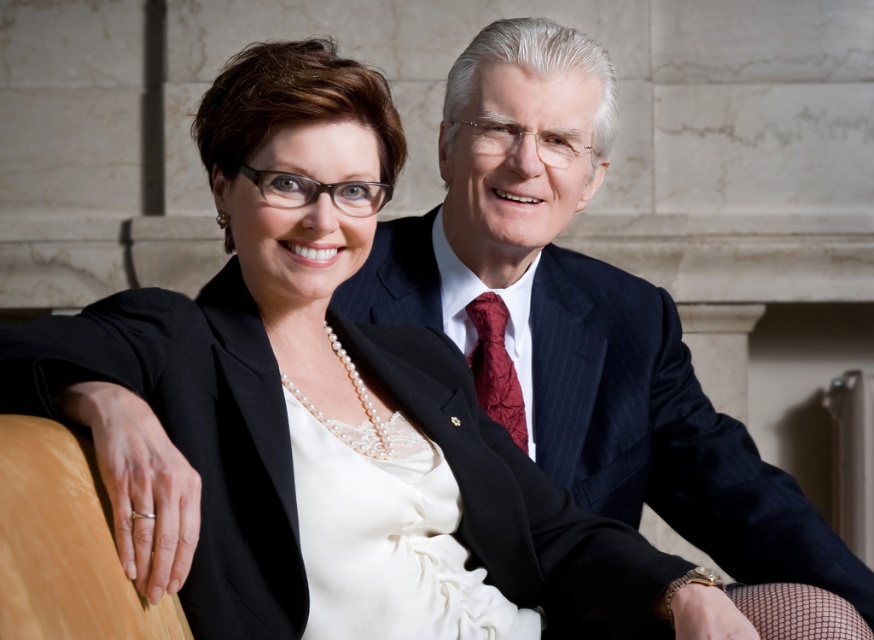
Based on the scene description, where is the dark blue pinstripe suit at upper right located in terms of coordinates?

The dark blue pinstripe suit at upper right is located at coordinates point (662, 433).